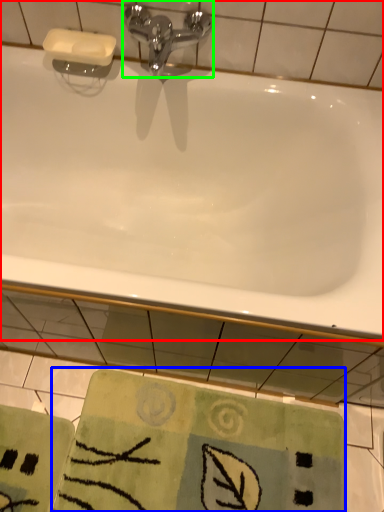
Question: Estimate the real-world distances between objects in this image. Which object is closer to bathtub (highlighted by a red box), beach towel (highlighted by a blue box) or tap (highlighted by a green box)?

Choices:
 (A) beach towel
 (B) tap

Answer: (B)